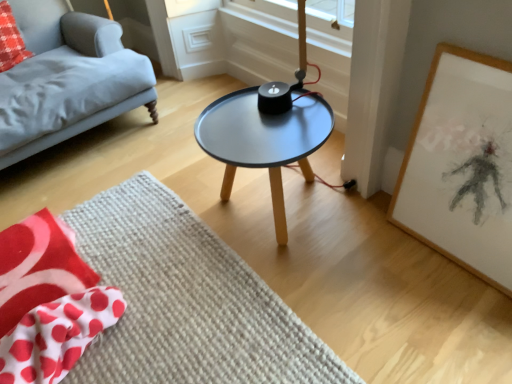
Question: Considering the relative sizes of matte gray fabric couch at left and white paper with charcoal drawing at right in the image provided, is matte gray fabric couch at left thinner than white paper with charcoal drawing at right?

Choices:
 (A) no
 (B) yes

Answer: (A)

Question: Is matte gray fabric couch at left to the left of white paper with charcoal drawing at right from the viewer's perspective?

Choices:
 (A) yes
 (B) no

Answer: (A)

Question: Is matte gray fabric couch at left directly adjacent to white paper with charcoal drawing at right?

Choices:
 (A) no
 (B) yes

Answer: (A)

Question: From the image's perspective, is matte gray fabric couch at left below white paper with charcoal drawing at right?

Choices:
 (A) yes
 (B) no

Answer: (B)

Question: Is matte gray fabric couch at left positioned before white paper with charcoal drawing at right?

Choices:
 (A) no
 (B) yes

Answer: (A)

Question: Is point (211, 130) closer or farther from the camera than point (17, 46)?

Choices:
 (A) farther
 (B) closer

Answer: (B)

Question: Considering the positions of matte black table at center and red polka dot fabric at upper left in the image, is matte black table at center bigger or smaller than red polka dot fabric at upper left?

Choices:
 (A) big
 (B) small

Answer: (A)

Question: From the image's perspective, relative to red polka dot fabric at upper left, is matte black table at center above or below?

Choices:
 (A) below
 (B) above

Answer: (A)

Question: Would you say matte black table at center is to the left or to the right of red polka dot fabric at upper left in the picture?

Choices:
 (A) left
 (B) right

Answer: (B)

Question: In terms of width, does red polka dot fabric at lower left look wider or thinner when compared to white paper with charcoal drawing at right?

Choices:
 (A) wide
 (B) thin

Answer: (A)

Question: In terms of height, does red polka dot fabric at lower left look taller or shorter compared to white paper with charcoal drawing at right?

Choices:
 (A) tall
 (B) short

Answer: (B)

Question: Based on their positions, is red polka dot fabric at lower left located to the left or right of white paper with charcoal drawing at right?

Choices:
 (A) right
 (B) left

Answer: (B)

Question: Considering the positions of point (29, 281) and point (435, 178), is point (29, 281) closer or farther from the camera than point (435, 178)?

Choices:
 (A) farther
 (B) closer

Answer: (A)

Question: From a real-world perspective, relative to red polka dot fabric at upper left, is beige textured mat at center vertically above or below?

Choices:
 (A) above
 (B) below

Answer: (B)

Question: Is beige textured mat at center wider or thinner than red polka dot fabric at upper left?

Choices:
 (A) thin
 (B) wide

Answer: (B)